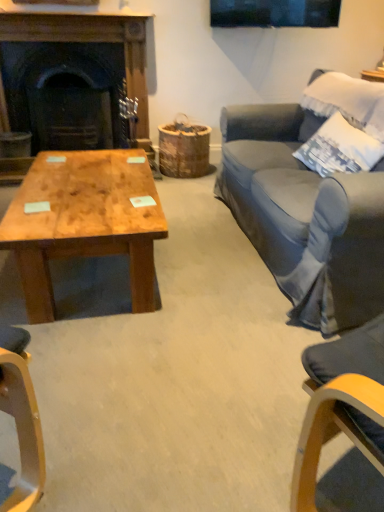
Find the location of a particular element. free point to the right of natural wood coffee table at lower left is located at coordinates (212, 265).